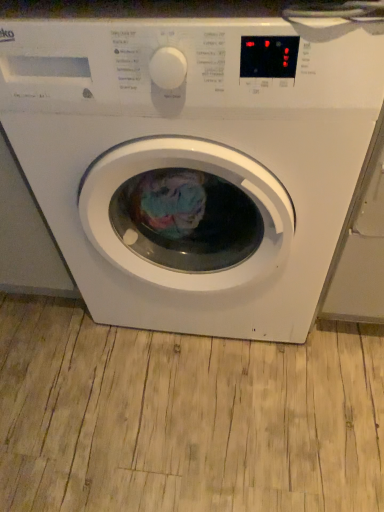
What do you see at coordinates (195, 151) in the screenshot? The height and width of the screenshot is (512, 384). I see `white glossy washing machine at center` at bounding box center [195, 151].

Locate an element on the screen. The image size is (384, 512). white glossy washing machine at center is located at coordinates coord(195,151).

Where is `white glossy washing machine at center`? The height and width of the screenshot is (512, 384). white glossy washing machine at center is located at coordinates (195, 151).